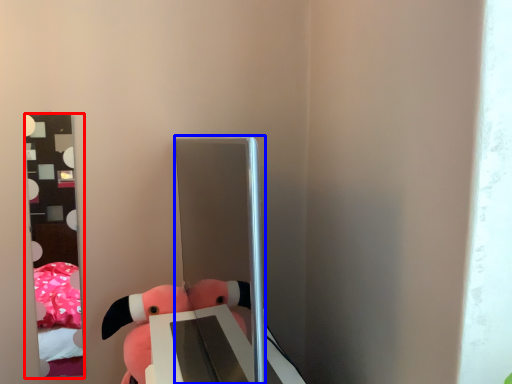
Question: Which object is further to the camera taking this photo, mirror (highlighted by a red box) or glass door (highlighted by a blue box)?

Choices:
 (A) mirror
 (B) glass door

Answer: (A)